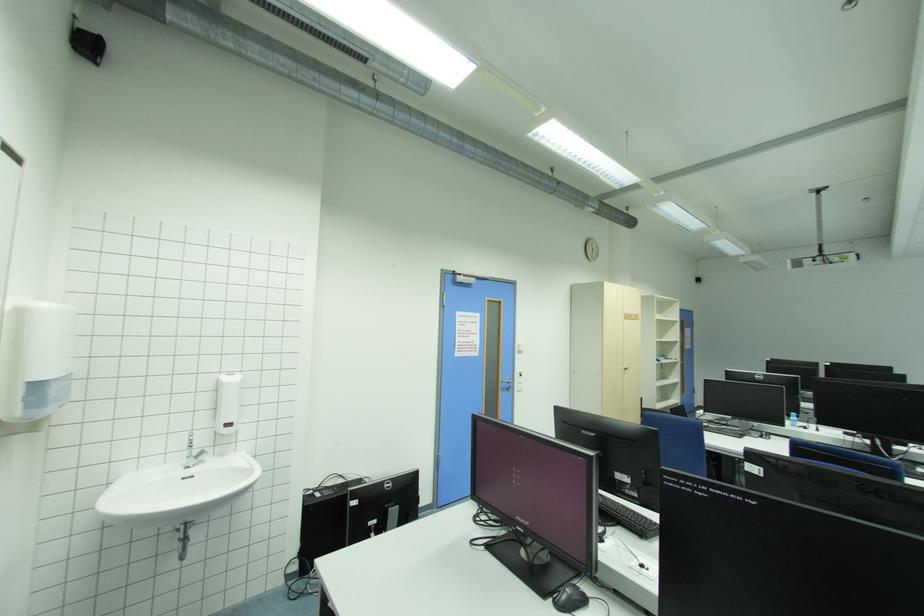
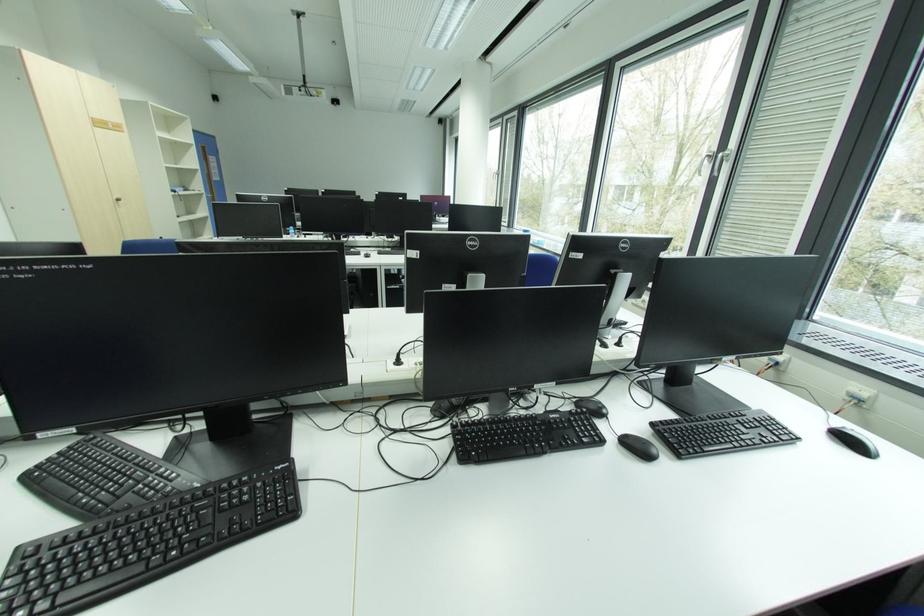
Find the pixel in the second image that matches point 795,413 in the first image.

(293, 228)